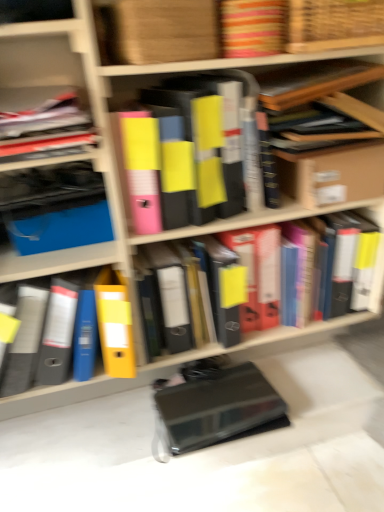
This screenshot has width=384, height=512. What do you see at coordinates (333, 24) in the screenshot?
I see `woven wood basket at upper center` at bounding box center [333, 24].

What are the coordinates of `black matte book at lower center` in the screenshot? It's located at (215, 406).

Describe the element at coordinates (252, 27) in the screenshot. The image size is (384, 512). I see `striped fabric book at upper center, acting as the fifth book starting from the bottom` at that location.

Where is `yellow matte folder at center, which is the fifth book from top to bottom`? yellow matte folder at center, which is the fifth book from top to bottom is located at coordinates pos(86,327).

From the image's perspective, is wooden frame at upper right, which is the 2th book from top to bottom, positioned above or below striped fabric book at upper center, acting as the fifth book starting from the bottom?

From the image's perspective, wooden frame at upper right, which is the 2th book from top to bottom, appears below striped fabric book at upper center, acting as the fifth book starting from the bottom.

From a real-world perspective, which is physically below, wooden frame at upper right, marked as the 4th book in a bottom-to-top arrangement, or striped fabric book at upper center, marked as the first book in a top-to-bottom arrangement?

wooden frame at upper right, marked as the 4th book in a bottom-to-top arrangement, from a real-world perspective.

From the picture: Is striped fabric book at upper center, acting as the fifth book starting from the bottom, at the back of wooden frame at upper right, which is the 2th book from top to bottom?

No.

Considering the relative sizes of wooden frame at upper right, which is the 2th book from top to bottom, and striped fabric book at upper center, marked as the first book in a top-to-bottom arrangement, in the image provided, is wooden frame at upper right, which is the 2th book from top to bottom, shorter than striped fabric book at upper center, marked as the first book in a top-to-bottom arrangement,?

No, wooden frame at upper right, which is the 2th book from top to bottom, is not shorter than striped fabric book at upper center, marked as the first book in a top-to-bottom arrangement.

Is black matte book at lower center positioned before yellow matte folder at center, arranged as the third book when ordered from the bottom?

No, it is not.

You are a GUI agent. You are given a task and a screenshot of the screen. Output one action in this format:
    pyautogui.click(x=<x>, y=<y>)
    Task: Click on the book that is the 3rd one when counting upward from the black matte book at lower center (from the image's perspective)
    
    Given the screenshot: What is the action you would take?
    pyautogui.click(x=209, y=139)

From a real-world perspective, is black matte book at lower center located beneath yellow matte folder at center, arranged as the third book when ordered from the bottom?

Yes.

In the scene shown: Is black matte book at lower center placed right next to yellow matte folder at center, which is the third book from top to bottom?

No, black matte book at lower center is not next to yellow matte folder at center, which is the third book from top to bottom.

Is yellow matte folder at center, which is the fifth book from top to bottom, next to cardboard box at upper right?

yellow matte folder at center, which is the fifth book from top to bottom, and cardboard box at upper right are not in contact.

Which object is closer to the camera taking this photo, yellow matte folder at center, which is the fifth book from top to bottom, or cardboard box at upper right?

yellow matte folder at center, which is the fifth book from top to bottom, is in front.

From the image's perspective, is yellow matte folder at center, which is the fifth book from top to bottom, under cardboard box at upper right?

Correct, yellow matte folder at center, which is the fifth book from top to bottom, appears lower than cardboard box at upper right in the image.

Is point (56, 292) farther from viewer compared to point (287, 183)?

No, it is not.

Consider the image. Which of these two, yellow matte folder at center, the 1th book in the bottom-to-top sequence, or wooden frame at upper right, which is the 2th book from top to bottom, is smaller?

wooden frame at upper right, which is the 2th book from top to bottom.

Consider the image. What's the angular difference between yellow matte folder at center, the 1th book in the bottom-to-top sequence, and wooden frame at upper right, which is the 2th book from top to bottom,'s facing directions?

They differ by 0.00067 degrees in their facing directions.

Consider the image. Is yellow matte folder at center, the 1th book in the bottom-to-top sequence, positioned beyond the bounds of wooden frame at upper right, marked as the 4th book in a bottom-to-top arrangement?

Indeed, yellow matte folder at center, the 1th book in the bottom-to-top sequence, is completely outside wooden frame at upper right, marked as the 4th book in a bottom-to-top arrangement.

Which point is more distant from viewer, [61,321] or [340,67]?

Positioned behind is point [340,67].

Is yellow matte folder at center, the 1th book in the bottom-to-top sequence, next to yellow matte folder at center, which is the third book from top to bottom, and touching it?

yellow matte folder at center, the 1th book in the bottom-to-top sequence, and yellow matte folder at center, which is the third book from top to bottom, are not in contact.

From a real-world perspective, is yellow matte folder at center, which is the fifth book from top to bottom, physically located above or below yellow matte folder at center, which is the third book from top to bottom?

In terms of real-world spatial position, yellow matte folder at center, which is the fifth book from top to bottom, is below yellow matte folder at center, which is the third book from top to bottom.

From the image's perspective, which one is positioned lower, yellow matte folder at center, the 1th book in the bottom-to-top sequence, or yellow matte folder at center, which is the third book from top to bottom?

yellow matte folder at center, the 1th book in the bottom-to-top sequence, appears lower in the image.

Is yellow matte folder at center, which is the fifth book from top to bottom, facing towards yellow matte folder at center, which is the third book from top to bottom?

No, yellow matte folder at center, which is the fifth book from top to bottom, is not turned towards yellow matte folder at center, which is the third book from top to bottom.

Who is taller, yellow matte folder at center, the 1th book in the bottom-to-top sequence, or black matte book at lower center?

yellow matte folder at center, the 1th book in the bottom-to-top sequence, is taller.

Does yellow matte folder at center, the 1th book in the bottom-to-top sequence, turn towards black matte book at lower center?

No, yellow matte folder at center, the 1th book in the bottom-to-top sequence, is not aimed at black matte book at lower center.

Is yellow matte folder at center, which is the fifth book from top to bottom, positioned beyond the bounds of black matte book at lower center?

That's correct, yellow matte folder at center, which is the fifth book from top to bottom, is outside of black matte book at lower center.

From the image's perspective, does yellow matte folder at center, the 1th book in the bottom-to-top sequence, appear higher than black matte book at lower center?

Indeed, from the image's perspective, yellow matte folder at center, the 1th book in the bottom-to-top sequence, is shown above black matte book at lower center.

Is yellow matte folder at center, the 1th book in the bottom-to-top sequence, facing towards woven wood basket at upper center?

No, yellow matte folder at center, the 1th book in the bottom-to-top sequence, is not aimed at woven wood basket at upper center.

Considering the relative positions of yellow matte folder at center, the 1th book in the bottom-to-top sequence, and woven wood basket at upper center in the image provided, is yellow matte folder at center, the 1th book in the bottom-to-top sequence, in front of woven wood basket at upper center?

No, yellow matte folder at center, the 1th book in the bottom-to-top sequence, is further to the viewer.

Does yellow matte folder at center, which is the fifth book from top to bottom, have a lesser width compared to woven wood basket at upper center?

In fact, yellow matte folder at center, which is the fifth book from top to bottom, might be wider than woven wood basket at upper center.

I want to click on the 5th book located beneath the woven wood basket at upper center (from a real-world perspective), so click(x=86, y=327).

Find the location of a particular element. book above the wooden frame at upper right, which is the 2th book from top to bottom (from a real-world perspective) is located at coordinates (252, 27).

Where is `book that is the 4th one when counting forward from the black matte book at lower center`? book that is the 4th one when counting forward from the black matte book at lower center is located at coordinates (209, 139).

Looking at the image, which one is located further to yellow matte folder at center, which is the fifth book from top to bottom, striped fabric book at upper center, marked as the first book in a top-to-bottom arrangement, or yellow matte folder at center, arranged as the third book when ordered from the bottom?

striped fabric book at upper center, marked as the first book in a top-to-bottom arrangement, lies further to yellow matte folder at center, which is the fifth book from top to bottom, than the other object.

Based on their spatial positions, is cardboard box at upper right or yellow matte folder at center, arranged as the third book when ordered from the bottom, further from black matte book at lower center?

cardboard box at upper right is further to black matte book at lower center.

Looking at this image, which object lies further to the anchor point yellow matte folder at center, which is the fifth book from top to bottom, cardboard box at upper right or yellow matte folder at center, which is the third book from top to bottom?

cardboard box at upper right.

Based on their spatial positions, is striped fabric book at upper center, acting as the fifth book starting from the bottom, or yellow matte folder at center, which ranks as the 2th book in bottom-to-top order, closer to wooden frame at upper right, marked as the 4th book in a bottom-to-top arrangement?

The object closer to wooden frame at upper right, marked as the 4th book in a bottom-to-top arrangement, is striped fabric book at upper center, acting as the fifth book starting from the bottom.

From the image, which object appears to be farther from yellow matte folder at center, acting as the 4th book starting from the top, yellow matte folder at center, the 1th book in the bottom-to-top sequence, or black matte book at lower center?

yellow matte folder at center, the 1th book in the bottom-to-top sequence, lies further to yellow matte folder at center, acting as the 4th book starting from the top, than the other object.

Based on their spatial positions, is wooden frame at upper right, marked as the 4th book in a bottom-to-top arrangement, or yellow matte folder at center, arranged as the third book when ordered from the bottom, closer to woven wood basket at upper center?

The object closer to woven wood basket at upper center is wooden frame at upper right, marked as the 4th book in a bottom-to-top arrangement.

Consider the image. When comparing their distances from yellow matte folder at center, the 1th book in the bottom-to-top sequence, does black matte book at lower center or striped fabric book at upper center, acting as the fifth book starting from the bottom, seem closer?

Based on the image, black matte book at lower center appears to be nearer to yellow matte folder at center, the 1th book in the bottom-to-top sequence.

Consider the image. Based on their spatial positions, is yellow matte folder at center, which is the third book from top to bottom, or wooden frame at upper right, which is the 2th book from top to bottom, further from woven wood basket at upper center?

yellow matte folder at center, which is the third book from top to bottom, is positioned further to the anchor woven wood basket at upper center.

At what (x,y) coordinates should I click in order to perform the action: click on cardboard box between wooden frame at upper right, which is the 2th book from top to bottom, and yellow matte folder at center, acting as the 4th book starting from the top, from top to bottom. Please return your answer as a coordinate pair (x, y). Image resolution: width=384 pixels, height=512 pixels. Looking at the image, I should click on (332, 172).

Identify the location of cardboard box between woven wood basket at upper center and yellow matte folder at center, acting as the 4th book starting from the top, in the vertical direction. This screenshot has height=512, width=384. (332, 172).

Image resolution: width=384 pixels, height=512 pixels. Find the location of `paperback book between yellow matte folder at center, which is the fifth book from top to bottom, and cardboard box at upper right from left to right`. paperback book between yellow matte folder at center, which is the fifth book from top to bottom, and cardboard box at upper right from left to right is located at coordinates (215, 406).

Locate an element on the screen. cardboard box between striped fabric book at upper center, marked as the first book in a top-to-bottom arrangement, and yellow matte folder at center, acting as the 4th book starting from the top, from top to bottom is located at coordinates [332, 172].